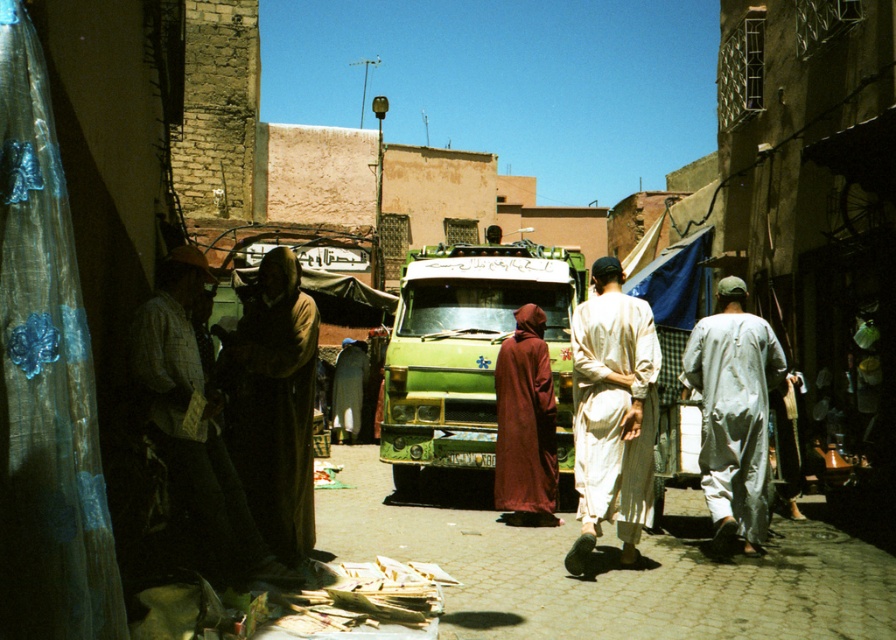
Looking at this image, who is lower down, white cotton robe at center or dark brown fabric at center?

Positioned lower is dark brown fabric at center.

Does point (636, 456) come farther from viewer compared to point (341, 422)?

No, it is not.

At what (x,y) coordinates should I click in order to perform the action: click on white cotton robe at center. Please return your answer as a coordinate pair (x, y). The width and height of the screenshot is (896, 640). Looking at the image, I should click on (613, 410).

Does light brown fabric robe at left have a lesser width compared to dark brown fabric at center?

Correct, light brown fabric robe at left's width is less than dark brown fabric at center's.

You are a GUI agent. You are given a task and a screenshot of the screen. Output one action in this format:
    pyautogui.click(x=<x>, y=<y>)
    Task: Click on the light brown fabric robe at left
    The width and height of the screenshot is (896, 640).
    Given the screenshot: What is the action you would take?
    pyautogui.click(x=191, y=436)

Where is `light brown fabric robe at left`? Image resolution: width=896 pixels, height=640 pixels. light brown fabric robe at left is located at coordinates (191, 436).

Which of these two, dark brown fabric at center or light brown fabric robe at center, stands shorter?

With less height is light brown fabric robe at center.

Does dark brown fabric at center have a smaller size compared to light brown fabric robe at center?

Incorrect, dark brown fabric at center is not smaller in size than light brown fabric robe at center.

Which is behind, point (363, 355) or point (785, 413)?

Point (363, 355)

Where is `dark brown fabric at center`? The image size is (896, 640). dark brown fabric at center is located at coordinates (349, 388).